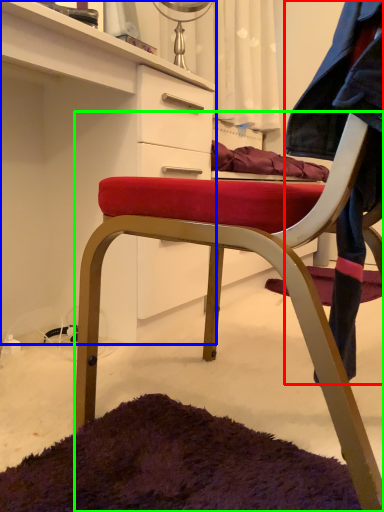
Question: Which is nearer to the denim jacket (highlighted by a red box)? cabinetry (highlighted by a blue box) or chair (highlighted by a green box).

Choices:
 (A) cabinetry
 (B) chair

Answer: (B)